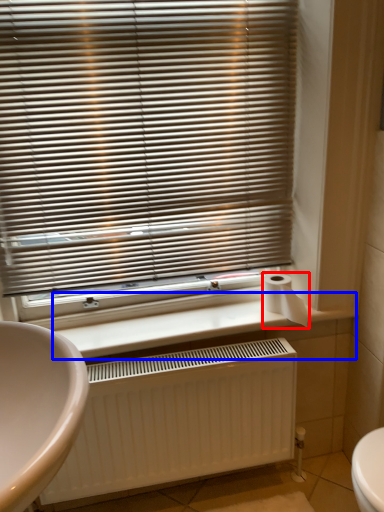
Question: Among these objects, which one is farthest to the camera, toilet paper (highlighted by a red box) or counter top (highlighted by a blue box)?

Choices:
 (A) toilet paper
 (B) counter top

Answer: (A)